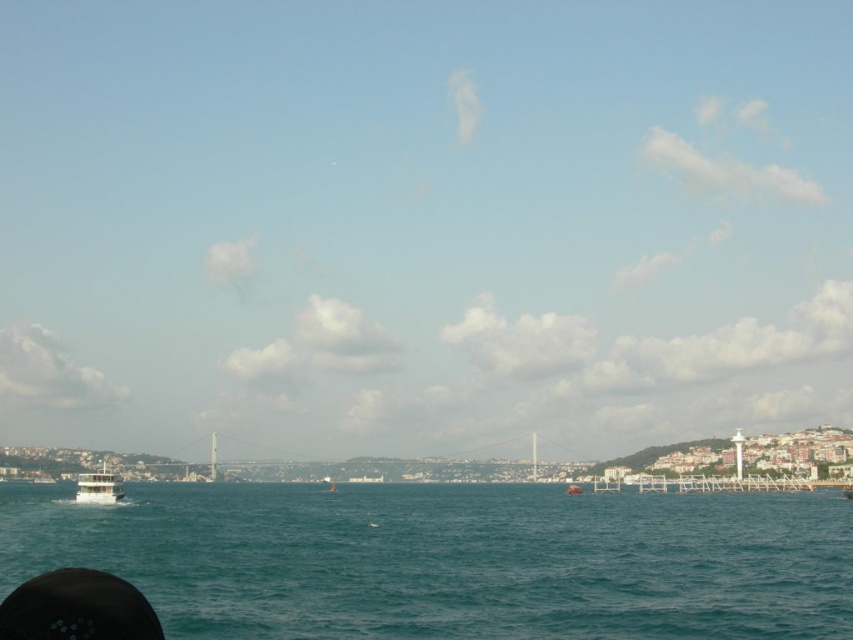
Between teal water at lower left and white glossy ferry at lower left, which one appears on the left side from the viewer's perspective?

From the viewer's perspective, white glossy ferry at lower left appears more on the left side.

Who is shorter, teal water at lower left or white glossy ferry at lower left?

With less height is white glossy ferry at lower left.

You are a GUI agent. You are given a task and a screenshot of the screen. Output one action in this format:
    pyautogui.click(x=<x>, y=<y>)
    Task: Click on the teal water at lower left
    Image resolution: width=853 pixels, height=640 pixels.
    Given the screenshot: What is the action you would take?
    pyautogui.click(x=450, y=561)

Where is `teal water at lower left`? This screenshot has height=640, width=853. teal water at lower left is located at coordinates (450, 561).

Measure the distance between white glossy ferry at lower left and white matte boat at lower center.

The distance of white glossy ferry at lower left from white matte boat at lower center is 104.31 meters.

Which is in front, point (117, 500) or point (581, 486)?

Point (117, 500)

Is point (80, 481) positioned in front of point (569, 484)?

Yes.

Where is `white glossy ferry at lower left`? white glossy ferry at lower left is located at coordinates [x=99, y=486].

The image size is (853, 640). What do you see at coordinates (450, 561) in the screenshot?
I see `teal water at lower left` at bounding box center [450, 561].

Is teal water at lower left above white matte boat at lower center?

→ Indeed, teal water at lower left is positioned over white matte boat at lower center.

What do you see at coordinates (450, 561) in the screenshot? I see `teal water at lower left` at bounding box center [450, 561].

Identify the location of teal water at lower left. (450, 561).